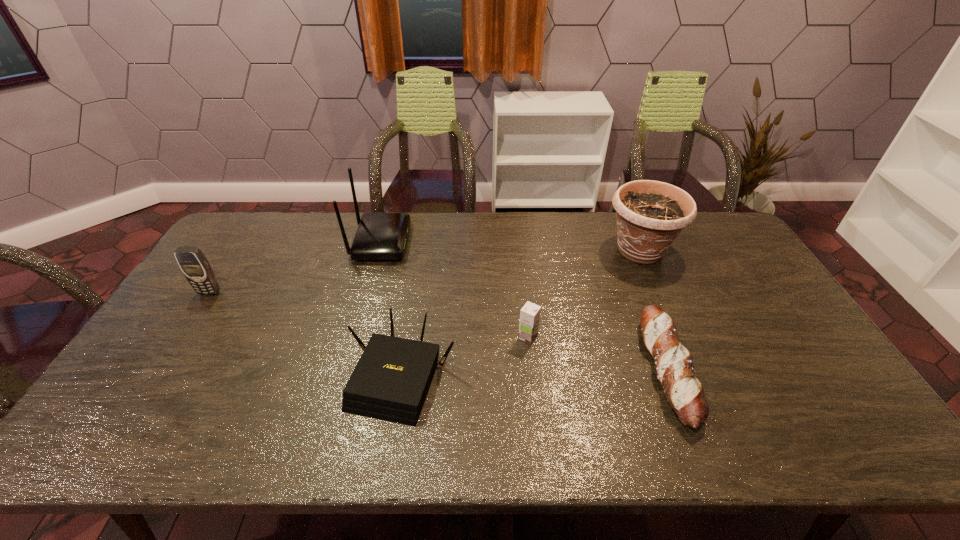
In order to click on free space at the left edge of the desktop in this screenshot , I will do `click(249, 264)`.

Find the location of a particular element. The image size is (960, 540). free region at the right edge of the desktop is located at coordinates (750, 299).

Where is `free space at the far left corner of the desktop`? This screenshot has height=540, width=960. free space at the far left corner of the desktop is located at coordinates (216, 249).

Locate an element on the screen. This screenshot has height=540, width=960. vacant space at the near right corner is located at coordinates coord(806,437).

Where is `unoccupied area between the flowerpot and the fourth object from left to right`? The height and width of the screenshot is (540, 960). unoccupied area between the flowerpot and the fourth object from left to right is located at coordinates (584, 294).

Locate an element on the screen. This screenshot has width=960, height=540. vacant space in between the nearer router and the leftmost object is located at coordinates (305, 335).

This screenshot has width=960, height=540. I want to click on free space between the shortest object and the third object from right to left, so click(x=597, y=354).

You are a GUI agent. You are given a task and a screenshot of the screen. Output one action in this format:
    pyautogui.click(x=<x>, y=<y>)
    Task: Click on the free space between the baguet and the third object from right to left
    This screenshot has width=960, height=540.
    Given the screenshot: What is the action you would take?
    pyautogui.click(x=597, y=354)

Locate an element on the screen. The height and width of the screenshot is (540, 960). vacant point located between the shortest object and the nearer router is located at coordinates (535, 374).

Identify the location of empty location between the flowerpot and the farther router. The height and width of the screenshot is (540, 960). (511, 246).